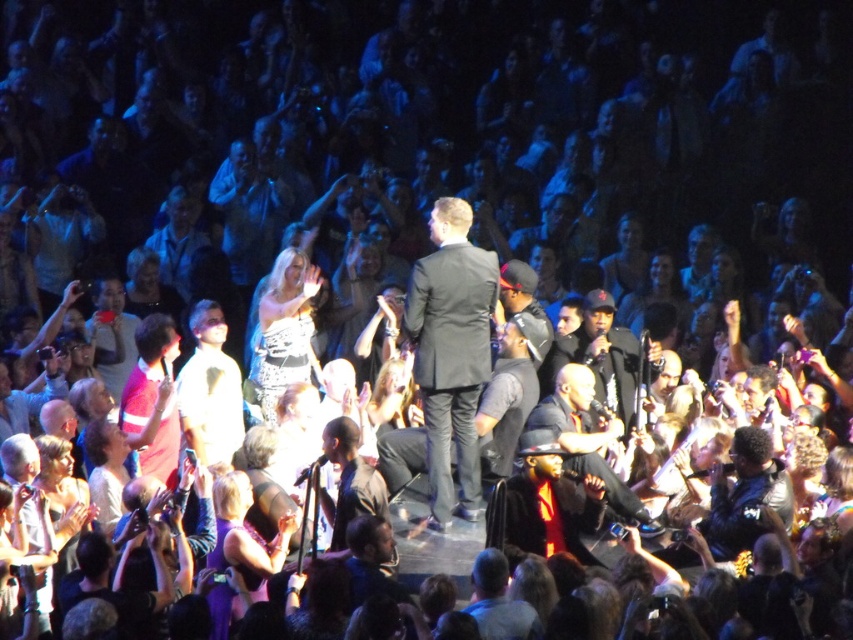
You are an attendee at the concert. You want to take a photo of the performer but need to avoid blocking the view of the person behind you. Which point, point (431, 522) or point (605, 420), is closer to the front of the stage and would be a better spot to stand?

Point (431, 522) is closer to the viewer than point (605, 420), so it is closer to the front of the stage and would be a better spot to stand to avoid blocking others behind you.

You are a photographer at the concert. You want to take a photo of both the matte black suit at center and the dark gray leather jacket at center. Which one will appear larger in your photo?

The matte black suit at center will appear larger in the photo because it is closer to the viewer than the dark gray leather jacket at center.

You are a photographer at the concert and want to capture both the matte black suit at center and the dark gray leather jacket at center in a single frame. Which object should you position closer to the left side of your camera viewfinder to include both?

To capture both the matte black suit at center and the dark gray leather jacket at center in a single frame, position the matte black suit at center closer to the left side of your camera viewfinder since it is already to the left of the dark gray leather jacket at center.